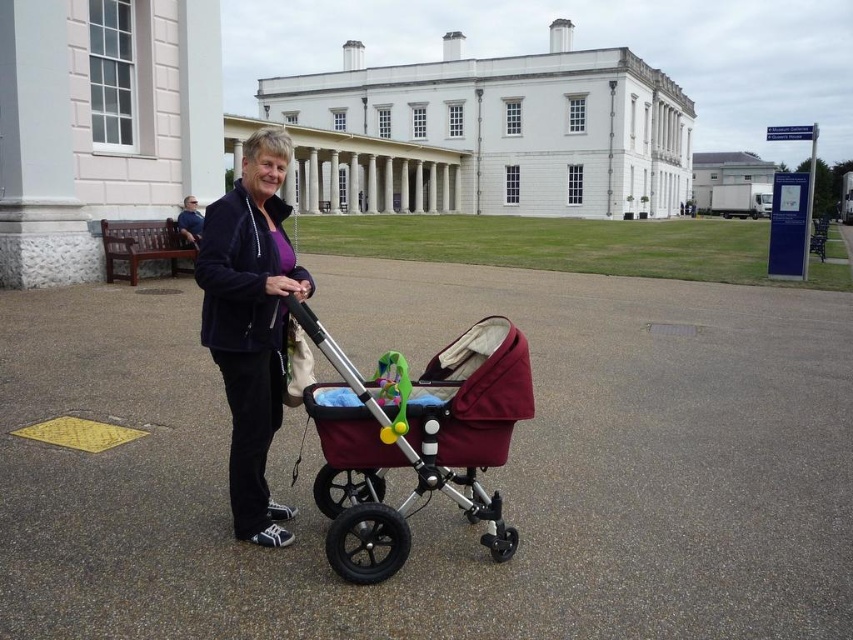
Question: Among these points, which one is nearest to the camera?

Choices:
 (A) (242, 289)
 (B) (180, 220)

Answer: (A)

Question: Which of the following is the closest to the observer?

Choices:
 (A) (194, 227)
 (B) (454, 390)

Answer: (B)

Question: Can you confirm if maroon fabric baby carriage at center is smaller than blue fabric shirt at upper center?

Choices:
 (A) no
 (B) yes

Answer: (A)

Question: Which object appears farthest from the camera in this image?

Choices:
 (A) velvet purple jacket at center
 (B) blue fabric shirt at upper center

Answer: (B)

Question: Is maroon fabric baby carriage at center to the left of blue fabric shirt at upper center from the viewer's perspective?

Choices:
 (A) no
 (B) yes

Answer: (A)

Question: Is maroon fabric baby carriage at center to the right of blue fabric shirt at upper center from the viewer's perspective?

Choices:
 (A) no
 (B) yes

Answer: (B)